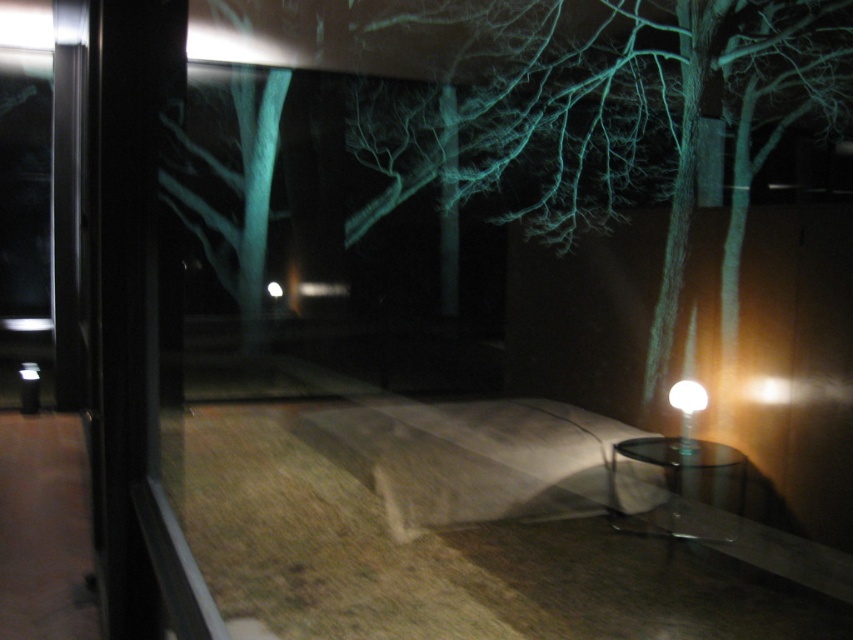
You are standing in the room and want to place a 5 meter long ladder between the green translucent tree at upper center and the table lamp near the right edge. Is there enough space?

The distance between the green translucent tree at upper center and the table lamp near the right edge is 5.12 meters, so yes, the ladder can be placed between them as the space is sufficient.

You are standing in the room and want to move towards the window to close the curtains. The white fabric bed at lower center is in your way. Can you go around it to reach the window?

The white fabric bed at lower center is located at point (485, 461) in the frame. Since it is blocking the path to the window, you can go around it to reach the window.

You are standing inside the room and want to turn off the white glossy lamp at right and the white glossy light at lower right. Which one do you need to walk closer to reach first?

The white glossy lamp at right is closer to the viewer than the white glossy light at lower right, so you need to walk closer to reach the white glossy lamp at right first.